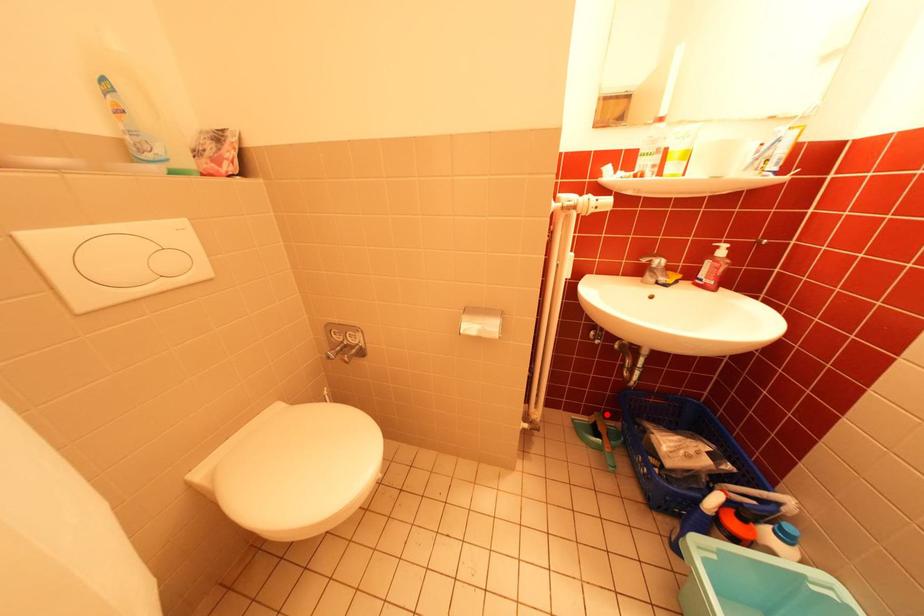
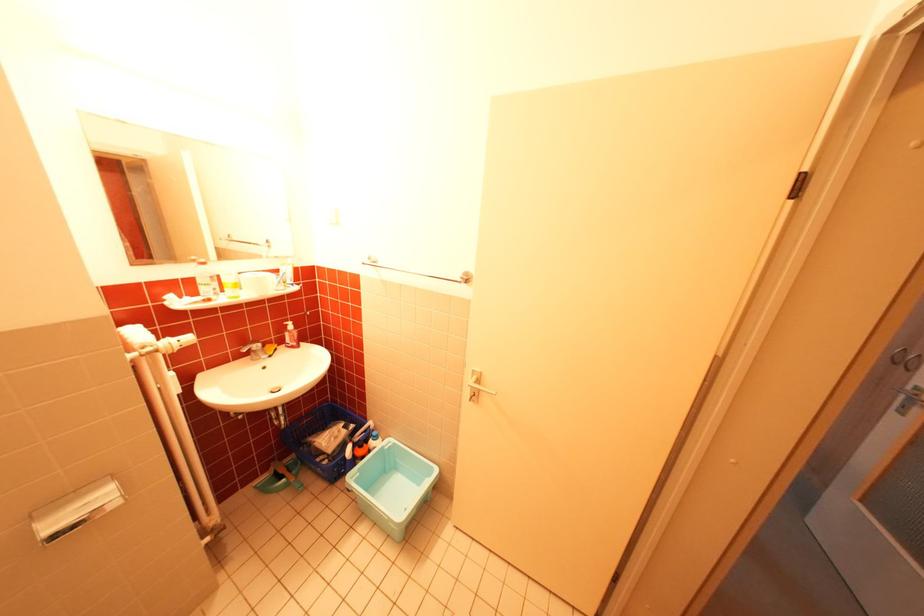
Question: I am providing you with two images of the same scene from different viewpoints. A red point is shown in image1. For the corresponding object point in image2, is it positioned nearer or farther from the camera?

Choices:
 (A) Nearer
 (B) Farther

Answer: (A)